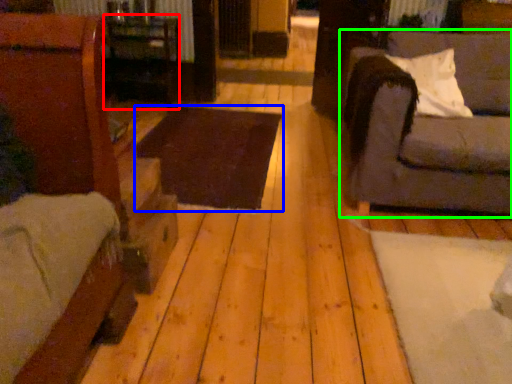
Question: Which object is the closest to the table (highlighted by a red box)? Choose among these: table (highlighted by a blue box) or studio couch (highlighted by a green box).

Choices:
 (A) table
 (B) studio couch

Answer: (A)